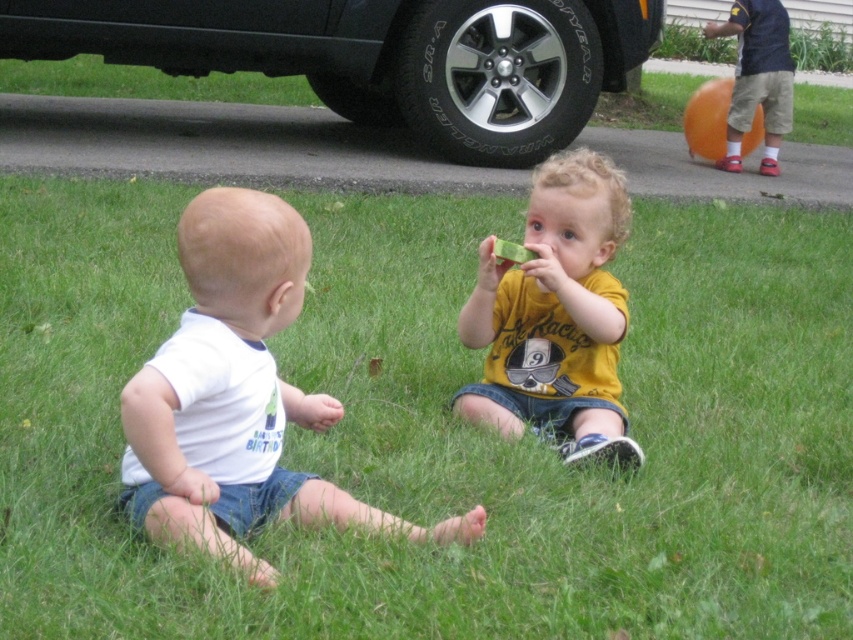
Question: Is yellow matte shirt at center positioned behind black rubber tire at center?

Choices:
 (A) yes
 (B) no

Answer: (B)

Question: Which of the following is the farthest from the observer?

Choices:
 (A) dark blue shirt at upper right
 (B) black rubber tire at upper center
 (C) green grass at center

Answer: (A)

Question: Can you confirm if black rubber tire at upper center is positioned below black rubber tire at center?

Choices:
 (A) no
 (B) yes

Answer: (A)

Question: Which point is farther to the camera?

Choices:
 (A) 747,428
 (B) 219,221
 (C) 447,68

Answer: (C)

Question: Which object is closer to the camera taking this photo?

Choices:
 (A) dark blue shirt at upper right
 (B) white cotton onesie at lower left

Answer: (B)

Question: Does yellow matte shirt at center appear on the right side of black rubber tire at center?

Choices:
 (A) no
 (B) yes

Answer: (A)